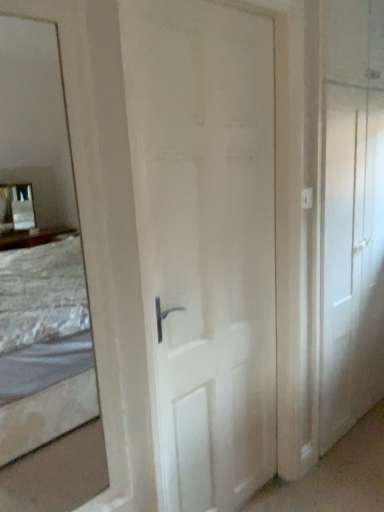
I want to click on free space above white matte door at center, which is the 1th door in left-to-right order (from a real-world perspective), so click(235, 5).